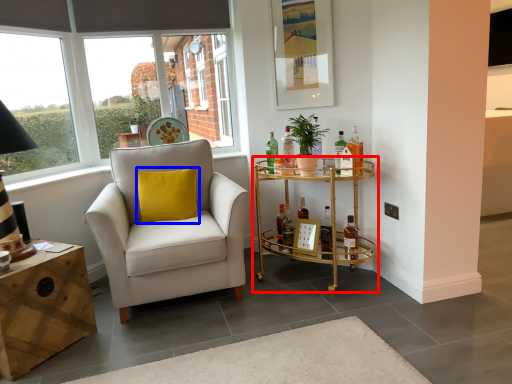
Question: Which of the following is the farthest to the observer, shelf (highlighted by a red box) or pillow (highlighted by a blue box)?

Choices:
 (A) shelf
 (B) pillow

Answer: (B)